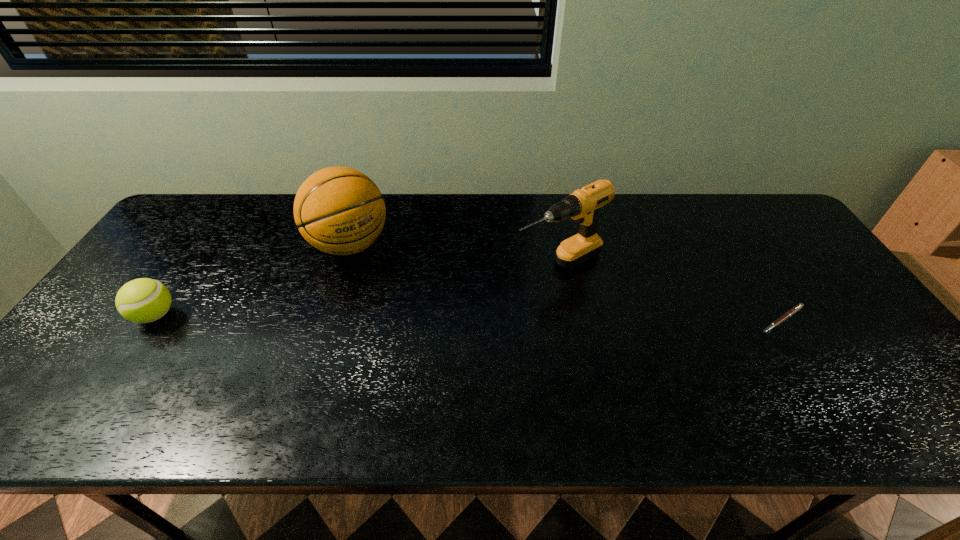
Locate an element on the screen. This screenshot has height=540, width=960. the leftmost object is located at coordinates (144, 300).

Where is `tennis ball`? The image size is (960, 540). tennis ball is located at coordinates (144, 300).

Locate an element on the screen. Image resolution: width=960 pixels, height=540 pixels. the shortest object is located at coordinates (792, 311).

This screenshot has height=540, width=960. In order to click on pen in this screenshot , I will do `click(792, 311)`.

You are a GUI agent. You are given a task and a screenshot of the screen. Output one action in this format:
    pyautogui.click(x=<x>, y=<y>)
    Task: Click on the third object from right to left
    
    Given the screenshot: What is the action you would take?
    pyautogui.click(x=338, y=210)

Where is `drill`? This screenshot has height=540, width=960. drill is located at coordinates (583, 205).

Identify the location of vacant position located on the front of the second shortest object. The image size is (960, 540). (116, 374).

You are a GUI agent. You are given a task and a screenshot of the screen. Output one action in this format:
    pyautogui.click(x=<x>, y=<y>)
    Task: Click on the free space located 0.130m at the nib of the pen
    This screenshot has height=540, width=960.
    Given the screenshot: What is the action you would take?
    pyautogui.click(x=820, y=381)

Where is `free space located on the surface of the second object from left to right near the brand logo`? The width and height of the screenshot is (960, 540). free space located on the surface of the second object from left to right near the brand logo is located at coordinates (404, 320).

Identify the location of free space located on the surface of the second object from left to right near the brand logo. (423, 346).